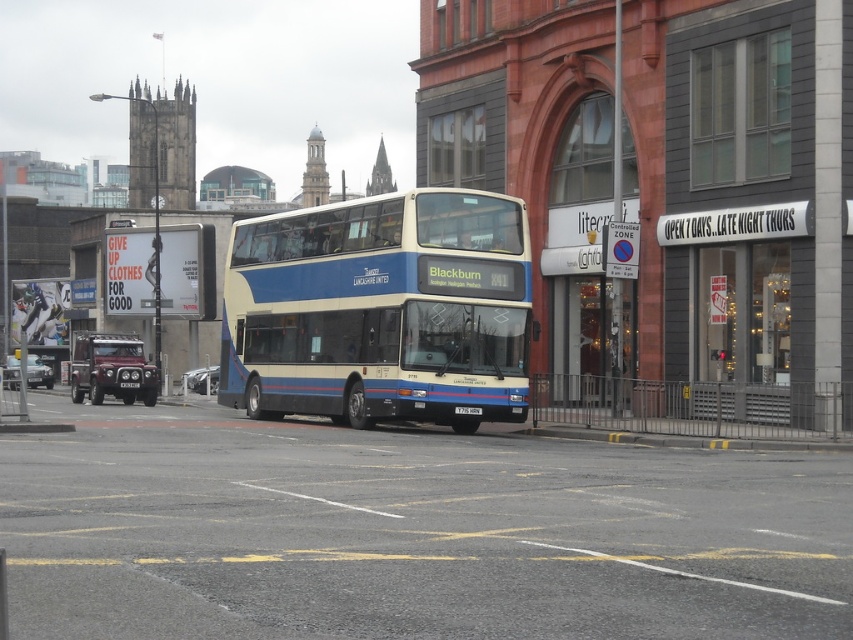
Question: Does blue metallic bus at center have a smaller size compared to maroon metallic suv at left?

Choices:
 (A) yes
 (B) no

Answer: (B)

Question: Which object is closer to the camera taking this photo?

Choices:
 (A) metallic silver car at center
 (B) metallic silver car at lower left
 (C) blue metallic bus at center
 (D) maroon metallic suv at left

Answer: (C)

Question: Which point appears closest to the camera in this image?

Choices:
 (A) (198, 371)
 (B) (16, 371)

Answer: (B)

Question: Which is nearer to the maroon metallic suv at left?

Choices:
 (A) black plastic license plate at center
 (B) metallic silver car at lower left
 (C) blue metallic bus at center
 (D) metallic silver car at center

Answer: (D)

Question: Can you confirm if blue metallic bus at center is positioned above metallic silver car at lower left?

Choices:
 (A) yes
 (B) no

Answer: (A)

Question: Considering the relative positions of metallic silver car at lower left and metallic silver car at center in the image provided, where is metallic silver car at lower left located with respect to metallic silver car at center?

Choices:
 (A) above
 (B) below

Answer: (B)